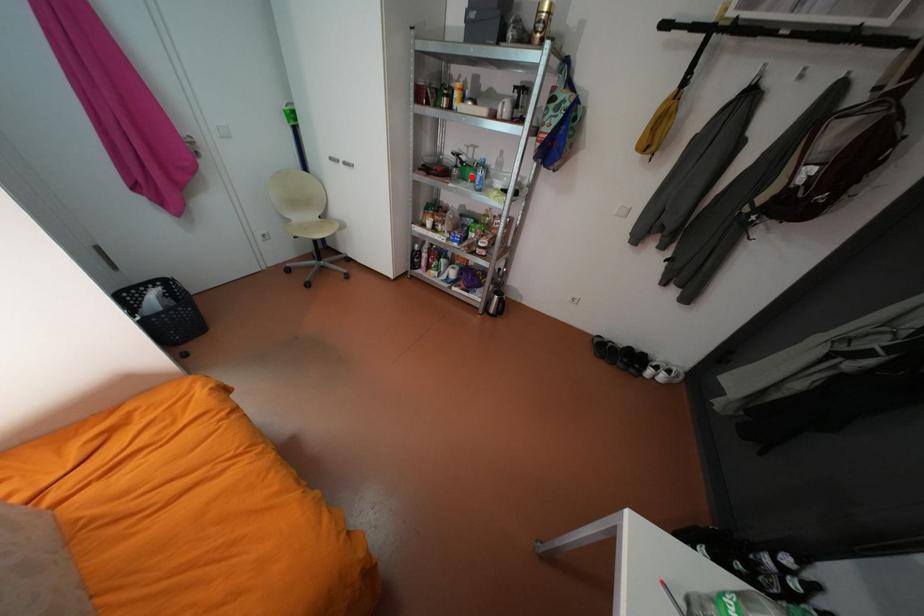
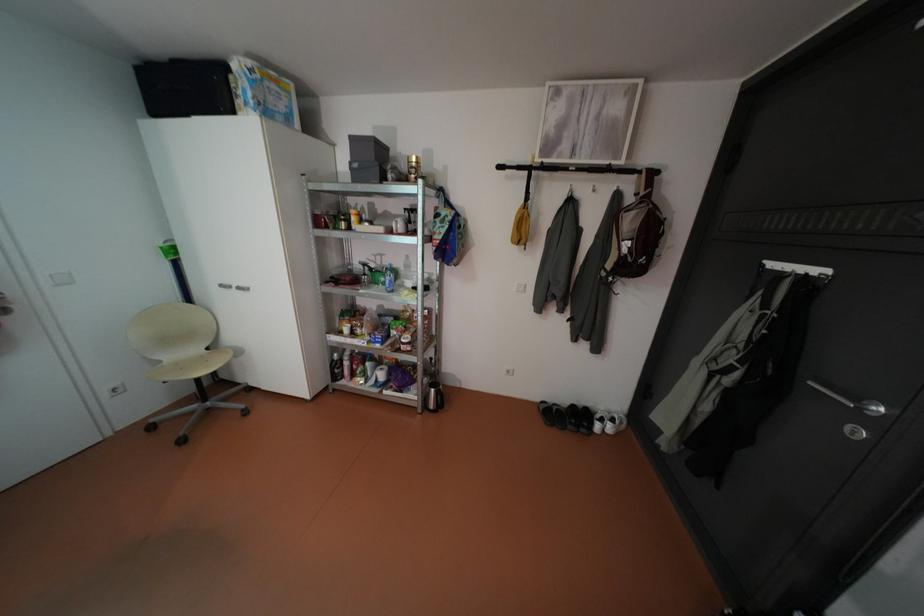
In the second image, find the point that corresponds to the highlighted location in the first image.

(383, 282)